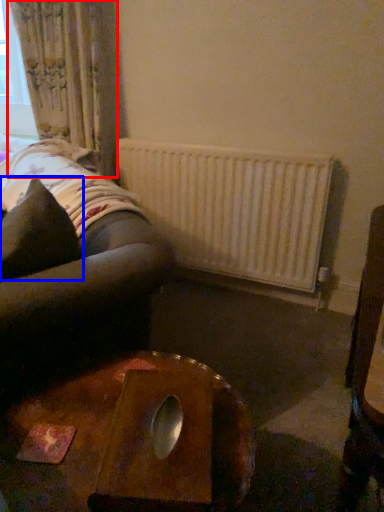
Question: Which point is closer to the camera, curtain (highlighted by a red box) or throw pillow (highlighted by a blue box)?

Choices:
 (A) curtain
 (B) throw pillow

Answer: (B)